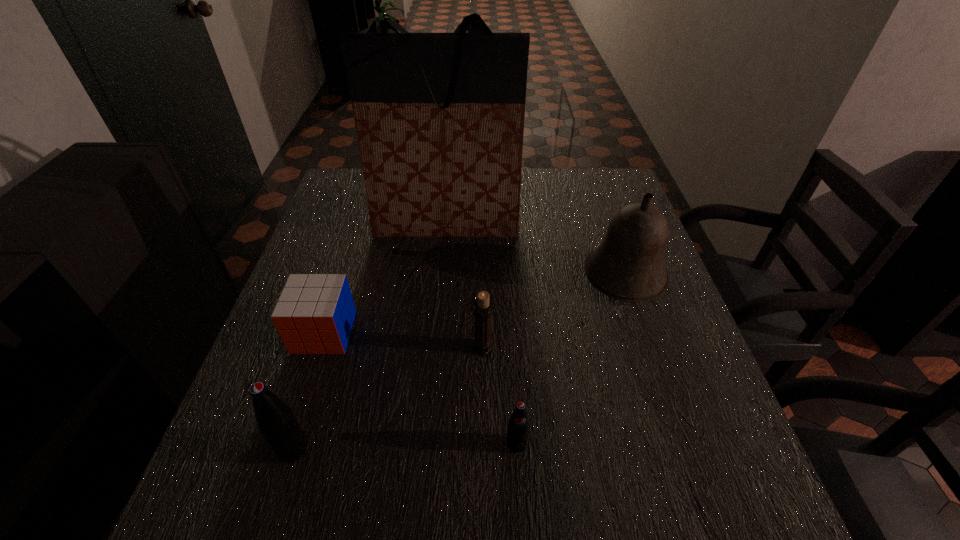
Find the location of a particular element. Image resolution: width=960 pixels, height=540 pixels. vacant space that satisfies the following two spatial constraints: 1. on the front-facing side of the farthest object; 2. on the left side of the bell is located at coordinates (442, 277).

Find the location of a particular element. free spot that satisfies the following two spatial constraints: 1. on the front-facing side of the tallest object; 2. on the front label of the left pop is located at coordinates click(x=426, y=448).